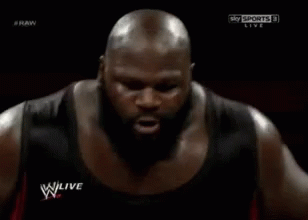
Where is `shoe`? Image resolution: width=308 pixels, height=220 pixels. shoe is located at coordinates (117, 202).